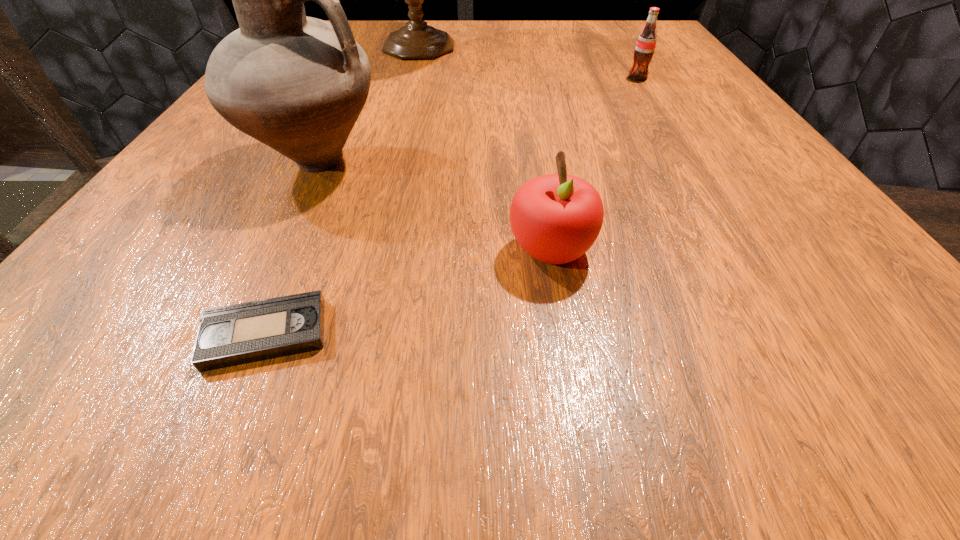
Locate an element on the screen. Image resolution: width=960 pixels, height=540 pixels. vacant point located between the tallest object and the soda is located at coordinates (528, 63).

Find the location of a particular element. The width and height of the screenshot is (960, 540). vacant point located between the pitcher and the second object from right to left is located at coordinates (434, 207).

Find the location of a particular element. This screenshot has width=960, height=540. vacant region between the apple and the fourth shortest object is located at coordinates (434, 207).

I want to click on free space between the fourth shortest object and the nearest object, so click(291, 248).

Where is `free spot between the third farthest object and the second object from right to left`? The height and width of the screenshot is (540, 960). free spot between the third farthest object and the second object from right to left is located at coordinates (434, 207).

Identify the location of free spot between the rightmost object and the nearest object. (451, 206).

Find the location of a particular element. The height and width of the screenshot is (540, 960). free spot between the soda and the tallest object is located at coordinates (528, 63).

You are a GUI agent. You are given a task and a screenshot of the screen. Output one action in this format:
    pyautogui.click(x=<x>, y=<y>)
    Task: Click on the object that is the second closest to the fourth shortest object
    The height and width of the screenshot is (540, 960).
    Given the screenshot: What is the action you would take?
    pyautogui.click(x=556, y=218)

What are the coordinates of `object that stands as the second closest to the nearest object` in the screenshot? It's located at (556, 218).

You are a GUI agent. You are given a task and a screenshot of the screen. Output one action in this format:
    pyautogui.click(x=<x>, y=<y>)
    Task: Click on the free region that satisfies the following two spatial constraints: 1. on the handle side of the nearest object; 2. on the left side of the pitcher
    
    Given the screenshot: What is the action you would take?
    pyautogui.click(x=234, y=334)